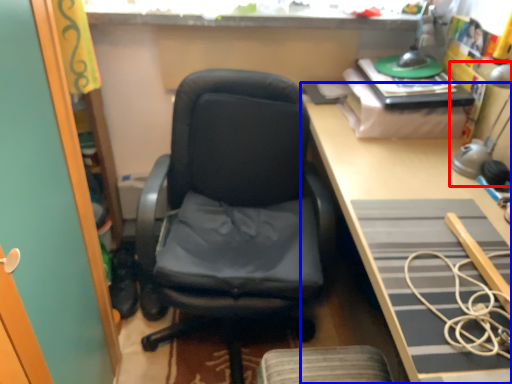
Question: Which of the following is the closest to the observer, table lamp (highlighted by a red box) or desk (highlighted by a blue box)?

Choices:
 (A) table lamp
 (B) desk

Answer: (B)